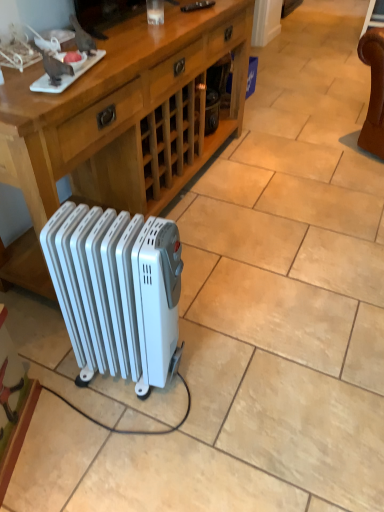
Question: Considering the positions of wooden desk at center and white plastic radiator at lower center in the image, is wooden desk at center wider or thinner than white plastic radiator at lower center?

Choices:
 (A) thin
 (B) wide

Answer: (B)

Question: From a real-world perspective, is wooden desk at center above or below white plastic radiator at lower center?

Choices:
 (A) above
 (B) below

Answer: (A)

Question: Is wooden desk at center spatially inside white plastic radiator at lower center, or outside of it?

Choices:
 (A) outside
 (B) inside

Answer: (A)

Question: Looking at their shapes, would you say white plastic radiator at lower center is wider or thinner than wooden desk at center?

Choices:
 (A) thin
 (B) wide

Answer: (A)

Question: From their relative heights in the image, would you say white plastic radiator at lower center is taller or shorter than wooden desk at center?

Choices:
 (A) short
 (B) tall

Answer: (A)

Question: Considering their positions, is white plastic radiator at lower center located in front of or behind wooden desk at center?

Choices:
 (A) front
 (B) behind

Answer: (A)

Question: Would you say white plastic radiator at lower center is to the left or to the right of wooden desk at center in the picture?

Choices:
 (A) left
 (B) right

Answer: (B)